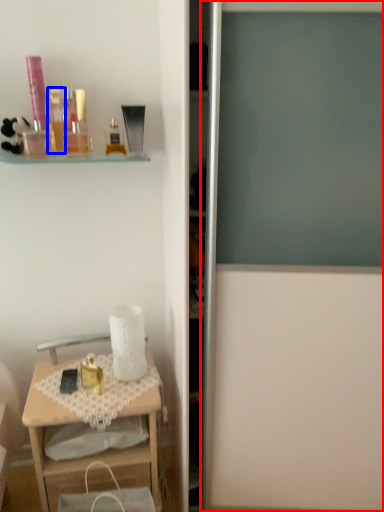
Question: Which object is further to the camera taking this photo, screen door (highlighted by a red box) or toiletry (highlighted by a blue box)?

Choices:
 (A) screen door
 (B) toiletry

Answer: (B)